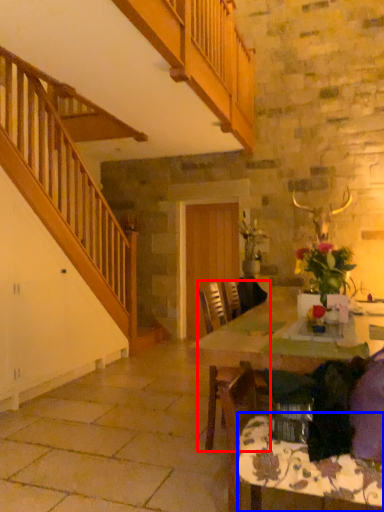
Question: Which of the following is the farthest to the observer, chair (highlighted by a red box) or tablecloth (highlighted by a blue box)?

Choices:
 (A) chair
 (B) tablecloth

Answer: (A)